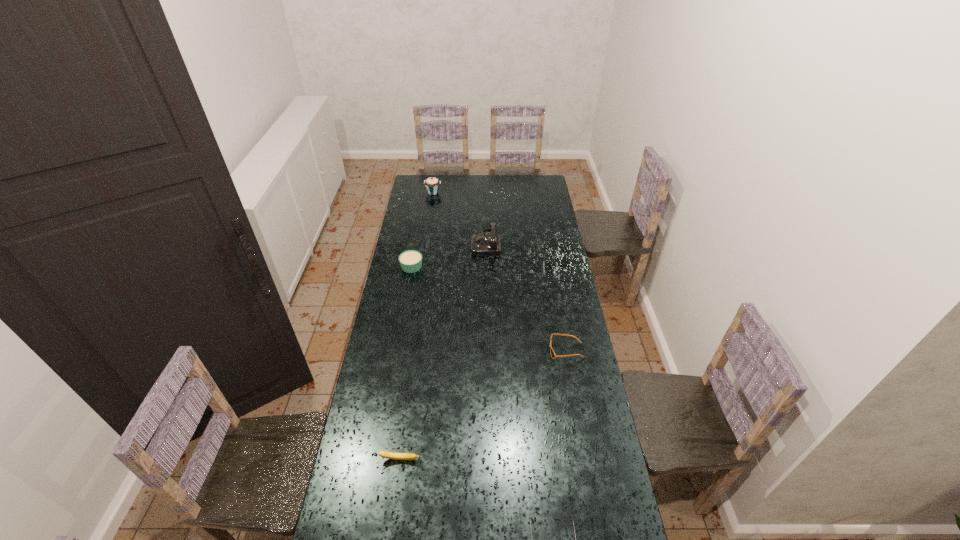
Locate an element on the screen. Image resolution: width=960 pixels, height=540 pixels. object situated at the right edge is located at coordinates (553, 355).

I want to click on object that is at the far left corner, so click(432, 184).

Find the location of a particular element. This screenshot has width=960, height=540. free space at the left edge of the desktop is located at coordinates point(375,524).

In the image, there is a desktop. At what (x,y) coordinates should I click in order to perform the action: click on free region at the right edge. Please return your answer as a coordinate pair (x, y). The height and width of the screenshot is (540, 960). Looking at the image, I should click on (535, 240).

The height and width of the screenshot is (540, 960). What are the coordinates of `free space at the far left corner of the desktop` in the screenshot? It's located at (420, 191).

This screenshot has height=540, width=960. In order to click on blank region between the rightmost object and the nearer cupcake in this screenshot , I will do `click(489, 309)`.

Where is `free space between the right sunglasses and the telephone`? The height and width of the screenshot is (540, 960). free space between the right sunglasses and the telephone is located at coordinates (526, 297).

Locate an element on the screen. unoccupied position between the fourth object from left to right and the third nearest object is located at coordinates (526, 297).

In order to click on free space between the fourth object from left to right and the shorter cupcake in this screenshot , I will do `click(448, 255)`.

The width and height of the screenshot is (960, 540). I want to click on vacant point located between the fifth farthest object and the fourth farthest object, so click(x=483, y=405).